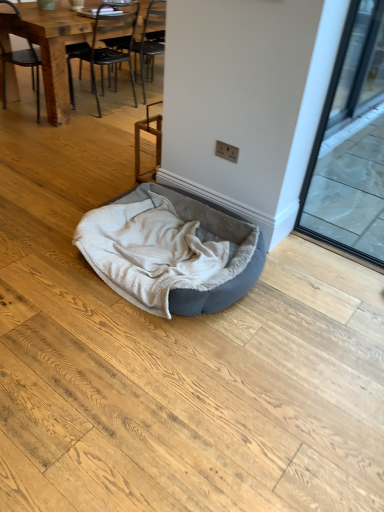
Question: Is point (64, 40) closer or farther from the camera than point (158, 273)?

Choices:
 (A) farther
 (B) closer

Answer: (A)

Question: From a real-world perspective, is wooden chair at left, the first chair viewed from the left, above or below velvet grey dog bed at center?

Choices:
 (A) below
 (B) above

Answer: (B)

Question: Based on their relative distances, which object is nearer to the black metal chair at upper left, the second chair in the left-to-right sequence?

Choices:
 (A) velvet grey dog bed at center
 (B) wooden chair at left, acting as the 2th chair starting from the right
 (C) transparent glass screen door at right

Answer: (B)

Question: Considering the real-world distances, which object is closest to the velvet grey dog bed at center?

Choices:
 (A) transparent glass screen door at right
 (B) black metal chair at upper left, the first chair in the right-to-left sequence
 (C) wooden chair at left, acting as the 2th chair starting from the right

Answer: (A)